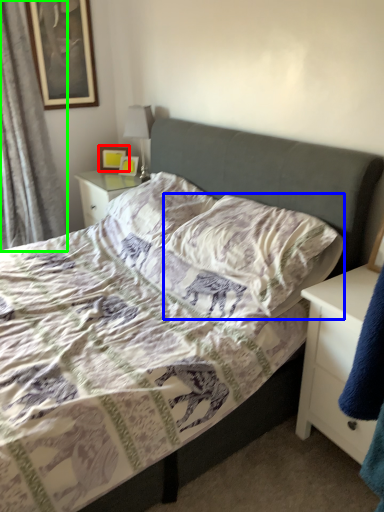
Question: Which object is the farthest from picture frame (highlighted by a red box)? Choose among these: pillow (highlighted by a blue box) or curtain (highlighted by a green box).

Choices:
 (A) pillow
 (B) curtain

Answer: (A)